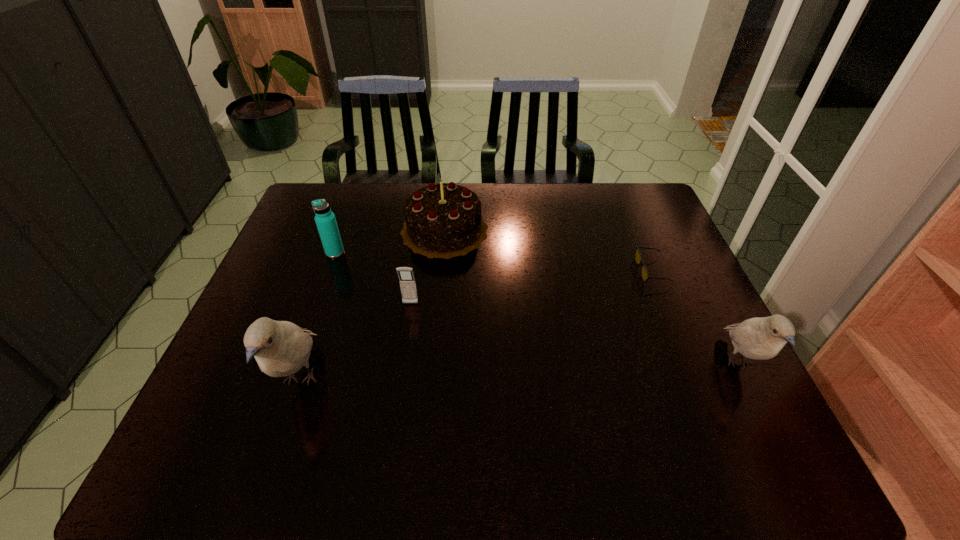
I want to click on the taller bird, so click(281, 348).

Locate an element on the screen. the tallest object is located at coordinates (281, 348).

What are the coordinates of `the shorter bird` in the screenshot? It's located at (761, 338).

Where is `the rightmost object`? The width and height of the screenshot is (960, 540). the rightmost object is located at coordinates (761, 338).

This screenshot has height=540, width=960. I want to click on birthday cake, so click(x=442, y=220).

I want to click on water bottle, so 325,220.

Find the location of a particular element. cellular telephone is located at coordinates (407, 282).

Locate an element on the screen. The image size is (960, 540). the fifth tallest object is located at coordinates (407, 282).

I want to click on the shortest object, so coord(638,258).

Find the location of `sunglasses`. sunglasses is located at coordinates (638, 258).